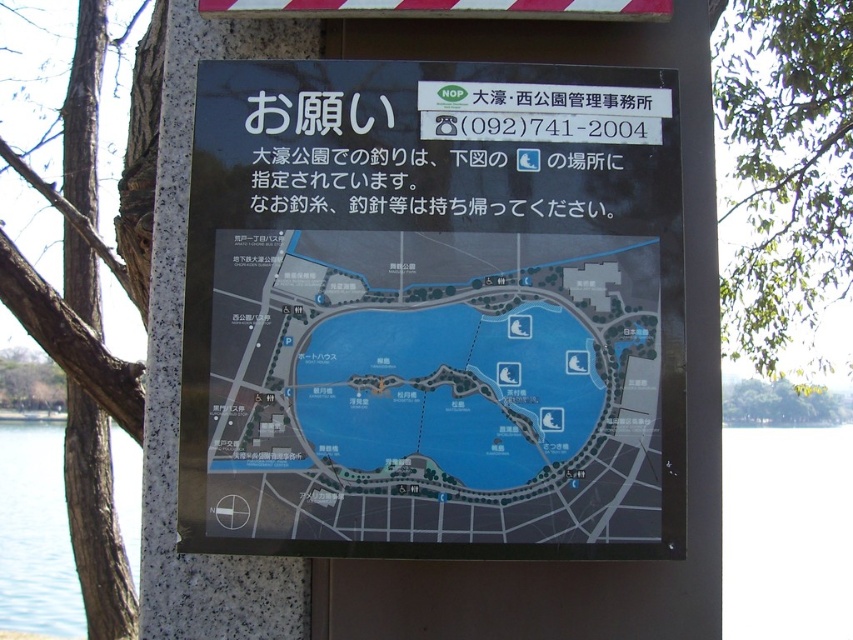
Question: Which point is closer to the camera taking this photo?

Choices:
 (A) (367, 536)
 (B) (71, 620)

Answer: (A)

Question: Can you confirm if blue paper map at center is positioned to the right of transparent water at lower left?

Choices:
 (A) no
 (B) yes

Answer: (B)

Question: Is blue paper map at center behind transparent water at lower left?

Choices:
 (A) no
 (B) yes

Answer: (A)

Question: Is blue paper map at center closer to the viewer compared to transparent water at lower left?

Choices:
 (A) yes
 (B) no

Answer: (A)

Question: Which of the following is the closest to the observer?

Choices:
 (A) (519, 490)
 (B) (49, 628)

Answer: (A)